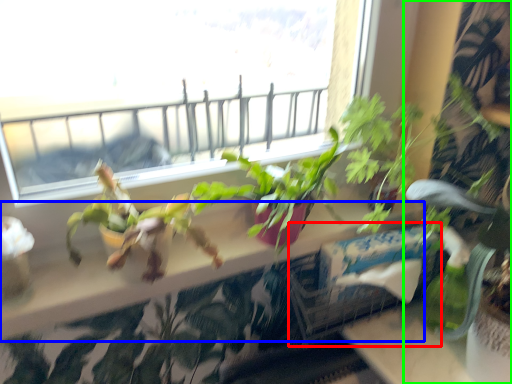
Question: Estimate the real-world distances between objects in this image. Which object is closer to window box (highlighted by a red box), window sill (highlighted by a blue box) or houseplant (highlighted by a green box)?

Choices:
 (A) window sill
 (B) houseplant

Answer: (A)